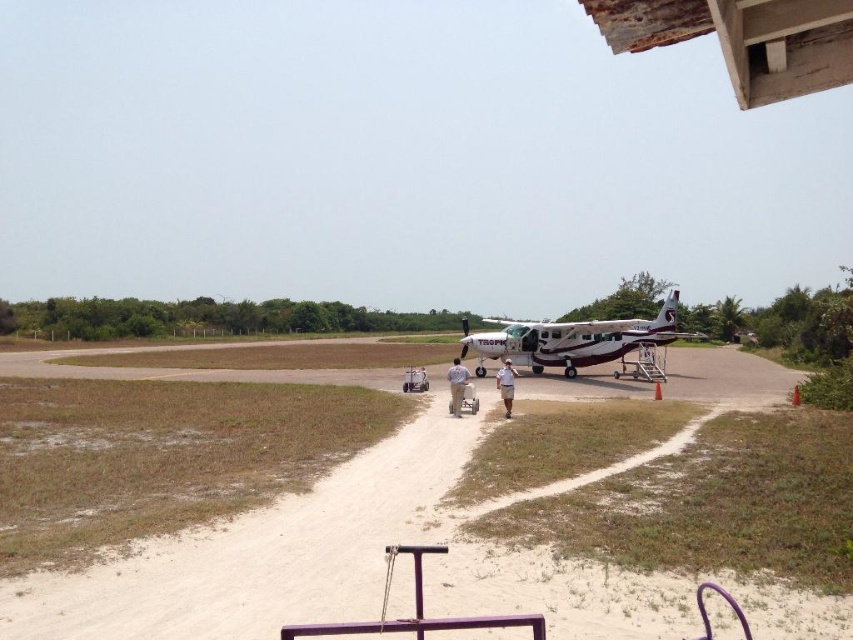
Question: Where is tan fabric shorts at center located in relation to khaki cotton shirt at center in the image?

Choices:
 (A) right
 (B) left

Answer: (B)

Question: Which object is the farthest from the tan fabric shorts at center?

Choices:
 (A) brown sandy dirt track at lower left
 (B) khaki cotton shirt at center
 (C) white matte airplane at center

Answer: (C)

Question: Which of the following is the farthest from the observer?

Choices:
 (A) tan fabric shorts at center
 (B) white matte airplane at center
 (C) khaki cotton shirt at center
 (D) brown sandy dirt track at lower left

Answer: (B)

Question: Which object is farther from the camera taking this photo?

Choices:
 (A) white matte airplane at center
 (B) tan fabric shorts at center

Answer: (A)

Question: Is brown sandy dirt track at lower left above khaki cotton shirt at center?

Choices:
 (A) yes
 (B) no

Answer: (B)

Question: Does tan fabric shorts at center appear on the left side of khaki cotton shirt at center?

Choices:
 (A) no
 (B) yes

Answer: (B)